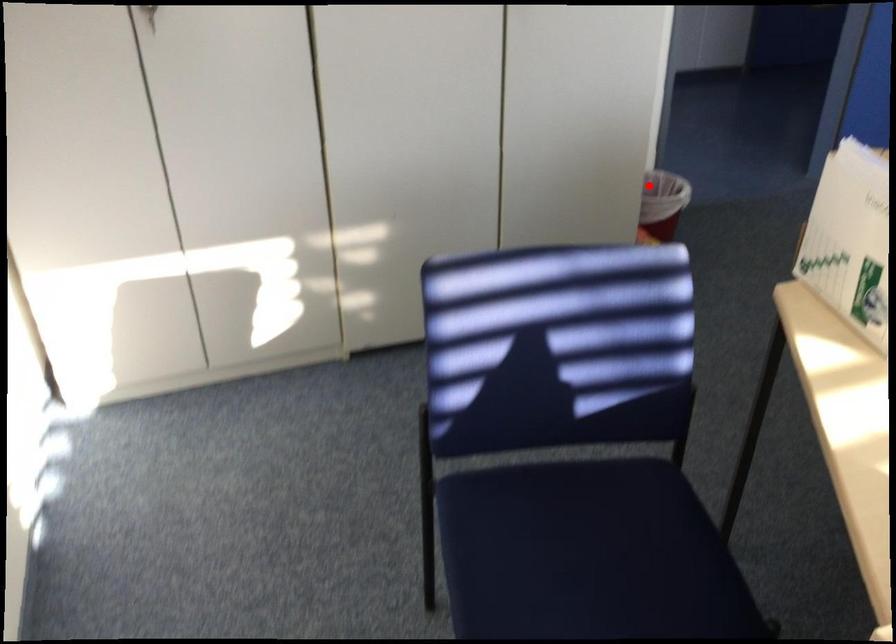
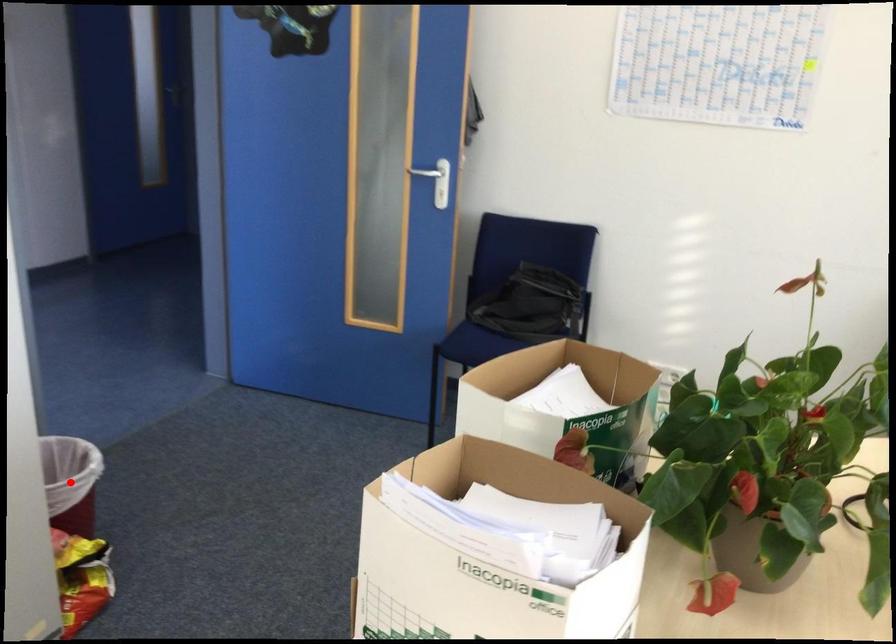
I am providing you with two images of the same scene from different viewpoints. A red point is marked on the first image and another point is marked on the second image. Are the points marked in image1 and image2 representing the same 3D position?

Yes